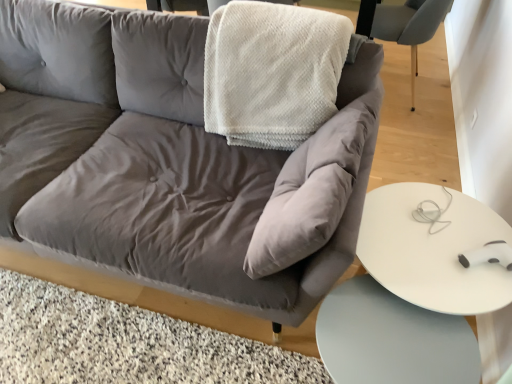
Find the location of `empty space that is ontop of white glossy table at lower right, the 2th table positioned from the bottom (from a real-world perspective)`. empty space that is ontop of white glossy table at lower right, the 2th table positioned from the bottom (from a real-world perspective) is located at coordinates (443, 254).